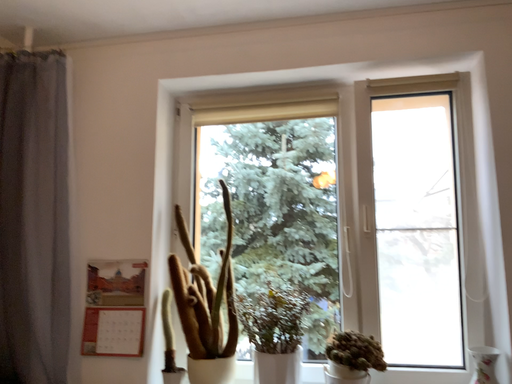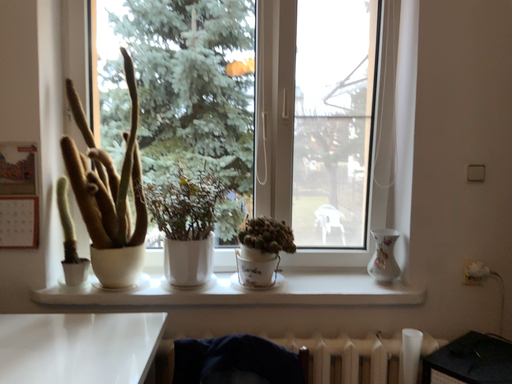
Question: Which way did the camera rotate in the video?

Choices:
 (A) rotated upward
 (B) rotated downward

Answer: (B)